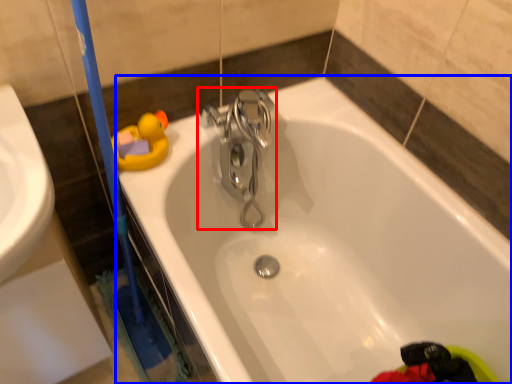
Question: Which object is closer to the camera taking this photo, tap (highlighted by a red box) or bathtub (highlighted by a blue box)?

Choices:
 (A) tap
 (B) bathtub

Answer: (B)